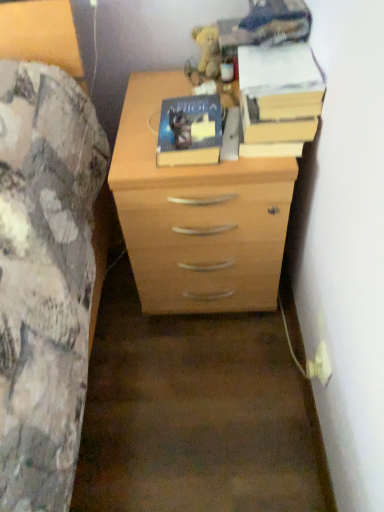
Question: From the image's perspective, is hardcover book at center, which appears as the first paperback book when viewed from the left, located beneath white plastic plug at lower right?

Choices:
 (A) yes
 (B) no

Answer: (B)

Question: Is hardcover book at center, which appears as the 2th paperback book when viewed from the right, surrounding white plastic plug at lower right?

Choices:
 (A) no
 (B) yes

Answer: (A)

Question: Is hardcover book at center, which appears as the 2th paperback book when viewed from the right, far away from white plastic plug at lower right?

Choices:
 (A) yes
 (B) no

Answer: (B)

Question: Does hardcover book at center, which appears as the 2th paperback book when viewed from the right, have a smaller size compared to white plastic plug at lower right?

Choices:
 (A) no
 (B) yes

Answer: (A)

Question: Can you confirm if hardcover book at center, which appears as the 2th paperback book when viewed from the right, is positioned to the left of white plastic plug at lower right?

Choices:
 (A) yes
 (B) no

Answer: (A)

Question: From the image's perspective, is light wood chest of drawers at center positioned above or below white plastic plug at lower right?

Choices:
 (A) below
 (B) above

Answer: (B)

Question: Is light wood chest of drawers at center to the left or to the right of white plastic plug at lower right in the image?

Choices:
 (A) left
 (B) right

Answer: (A)

Question: Is light wood chest of drawers at center in front of or behind white plastic plug at lower right in the image?

Choices:
 (A) front
 (B) behind

Answer: (A)

Question: Considering the positions of light wood chest of drawers at center and white plastic plug at lower right in the image, is light wood chest of drawers at center taller or shorter than white plastic plug at lower right?

Choices:
 (A) tall
 (B) short

Answer: (A)

Question: Is white plastic plug at lower right in front of or behind hardcover book at center, which appears as the 2th paperback book when viewed from the right, in the image?

Choices:
 (A) front
 (B) behind

Answer: (B)

Question: Which is correct: white plastic plug at lower right is inside hardcover book at center, which appears as the first paperback book when viewed from the left, or outside of it?

Choices:
 (A) inside
 (B) outside

Answer: (B)

Question: Does point (314, 369) appear closer or farther from the camera than point (218, 134)?

Choices:
 (A) closer
 (B) farther

Answer: (B)

Question: Is white plastic plug at lower right to the left or to the right of hardcover book at center, which appears as the first paperback book when viewed from the left, in the image?

Choices:
 (A) right
 (B) left

Answer: (A)

Question: Looking at the image, does yellow paper at upper right, which is counted as the 2th paperback book, starting from the left, seem bigger or smaller compared to white plastic plug at lower right?

Choices:
 (A) big
 (B) small

Answer: (A)

Question: Relative to white plastic plug at lower right, is yellow paper at upper right, which is counted as the 2th paperback book, starting from the left, in front or behind?

Choices:
 (A) front
 (B) behind

Answer: (A)